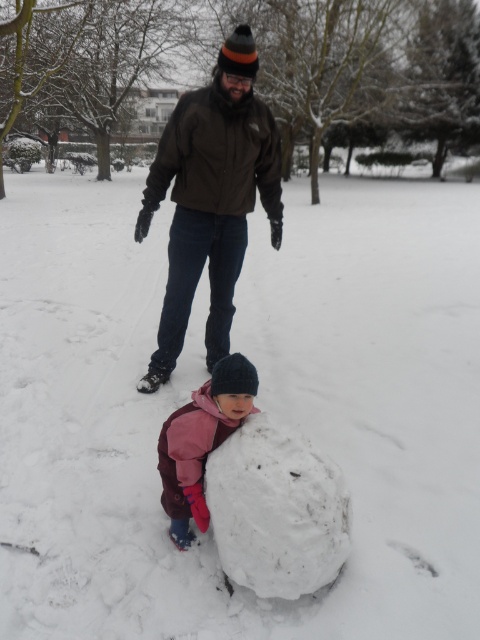
You are a photographer trying to capture a clear shot of the dark brown jacket at center and the white fluffy snowball at lower center. Since the snowball is partially hidden behind the jacket, will you need to adjust your camera angle to see both objects fully?

The dark brown jacket at center is larger in size than the white fluffy snowball at lower center. Therefore, the jacket is blocking part of the snowball. To capture both fully, you should adjust your angle to avoid the jacket obscuring the snowball.

You are a parent trying to locate your child in a snowy area. You see two jackets at the center of your view, a dark brown softshell jacket at center and a pink fleece jacket at center. Which jacket is closer to you?

The pink fleece jacket at center is closer to you since the distance between dark brown softshell jacket at center and pink fleece jacket at center is 2.00 meters, implying that the pink fleece jacket is nearer.

You are a photographer trying to capture a photo of the white fluffy snowball at lower center without the dark brown jacket at center blocking the view. From which side should you position yourself relative to the snowball?

You should position yourself to the right side of the white fluffy snowball at lower center because the dark brown jacket at center is located to its left, so standing on the right would avoid the jacket blocking the view.